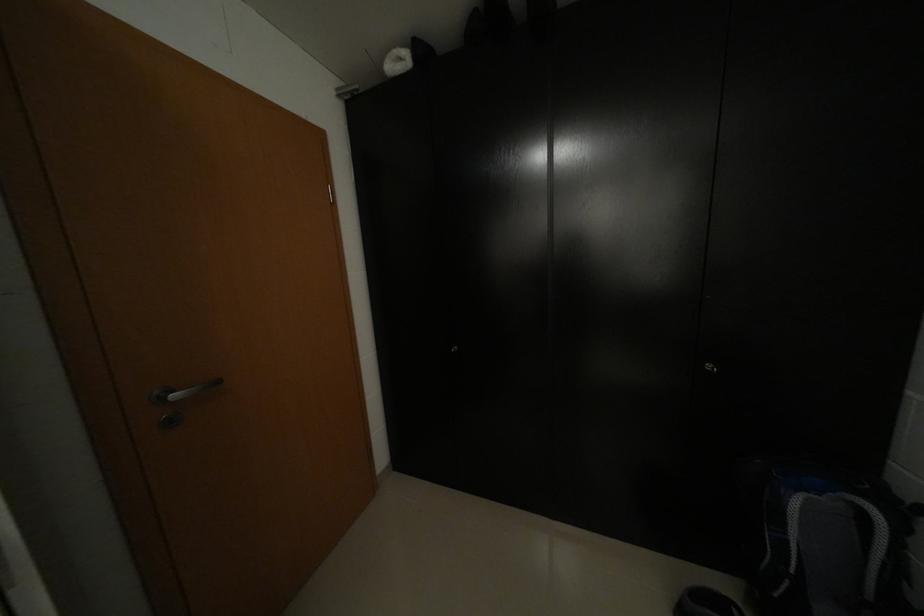
Find where to pull the silver door handle. Please return your answer as a coordinate pair (x, y).

(179, 400)